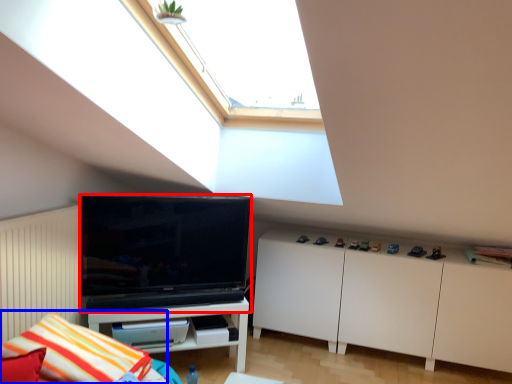
Question: Which of the following is the closest to the observer, television (highlighted by a red box) or pillow (highlighted by a blue box)?

Choices:
 (A) television
 (B) pillow

Answer: (B)